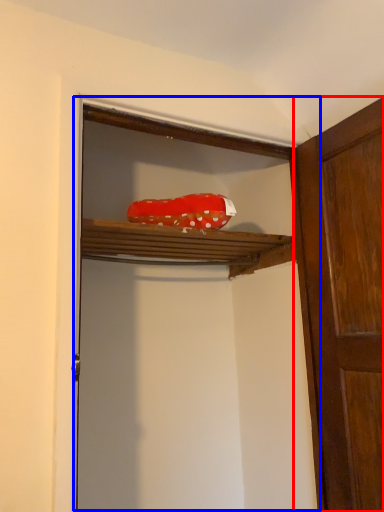
Question: Among these objects, which one is farthest to the camera, door (highlighted by a red box) or cabinetry (highlighted by a blue box)?

Choices:
 (A) door
 (B) cabinetry

Answer: (A)